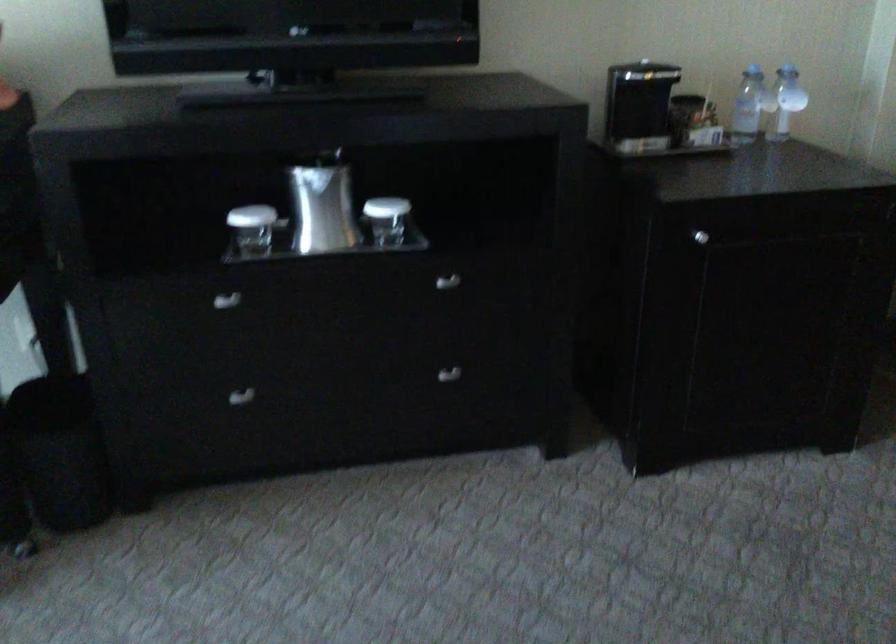
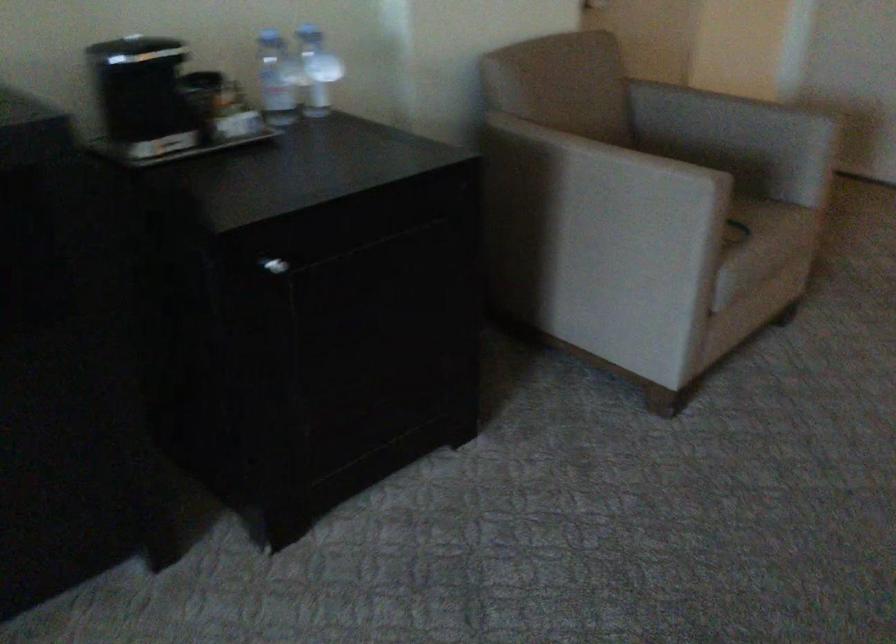
Question: The camera is either moving clockwise (left) or counter-clockwise (right) around the object. The first image is from the beginning of the video and the second image is from the end. Is the camera moving left or right when shooting the video?

Choices:
 (A) Left
 (B) Right

Answer: (A)